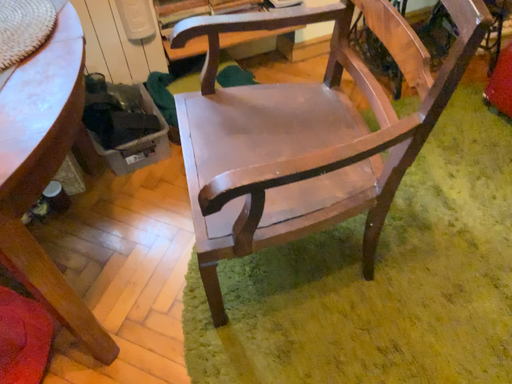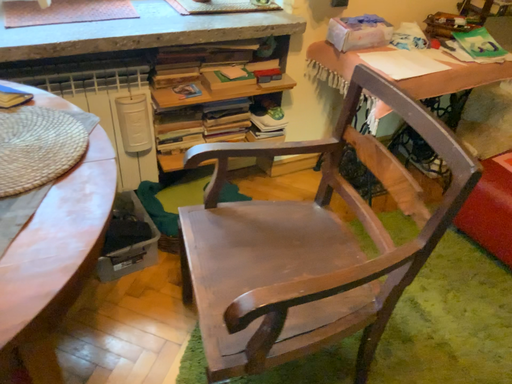
Question: Which way did the camera rotate in the video?

Choices:
 (A) rotated upward
 (B) rotated downward

Answer: (A)